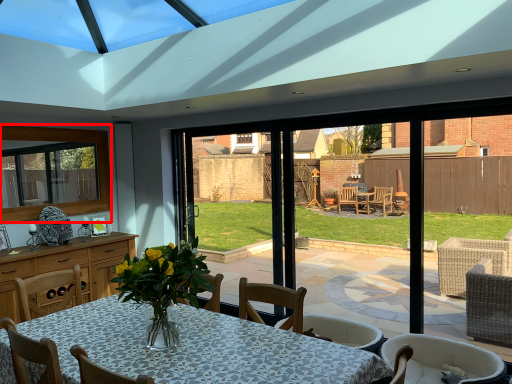
Question: In this image, where is window (annotated by the red box) located relative to chair?

Choices:
 (A) right
 (B) left

Answer: (B)